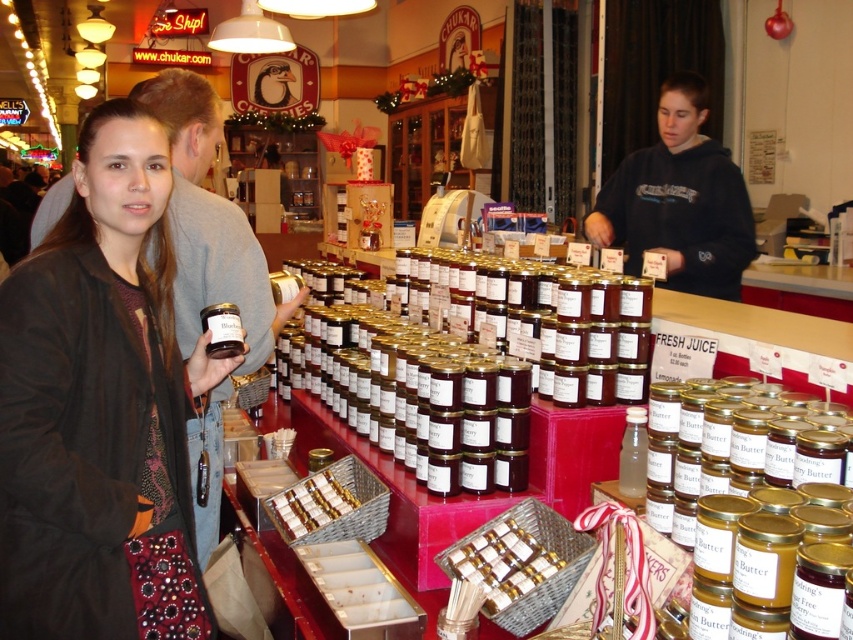
Consider the image. Is matte black jacket at left smaller than black hoodie at center?

Yes, matte black jacket at left is smaller than black hoodie at center.

The image size is (853, 640). What do you see at coordinates (100, 408) in the screenshot? I see `matte black jacket at left` at bounding box center [100, 408].

Between point (90, 502) and point (732, 291), which one is positioned in front?

Point (90, 502)

Identify the location of matte black jacket at left. (100, 408).

Is point (56, 531) farther from camera compared to point (281, 516)?

No, it is in front of (281, 516).

Who is higher up, matte black jacket at left or shiny chocolate bar at center?

matte black jacket at left is above.

Who is more distant from viewer, (x=96, y=307) or (x=310, y=516)?

The point (x=310, y=516) is more distant.

Find the location of a particular element. matte black jacket at left is located at coordinates (100, 408).

Find the location of `black hoodie at center`. black hoodie at center is located at coordinates (679, 200).

From the picture: Between black hoodie at center and shiny chocolate bar at center, which one has less height?

shiny chocolate bar at center is shorter.

Locate an element on the screen. The height and width of the screenshot is (640, 853). black hoodie at center is located at coordinates (679, 200).